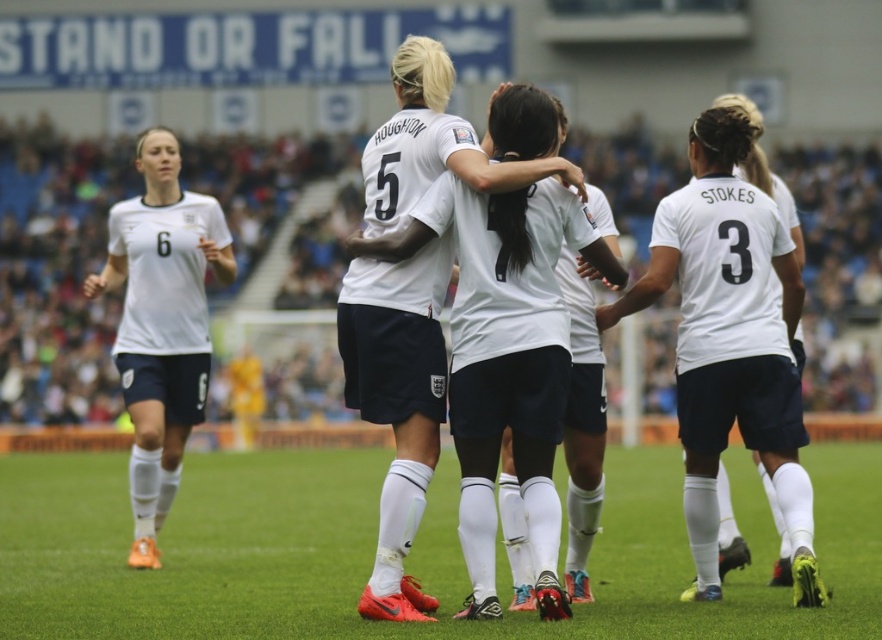
Question: Observing the image, what is the correct spatial positioning of white synthetic turf at center in reference to white matte jersey at left?

Choices:
 (A) left
 (B) right

Answer: (B)

Question: Estimate the real-world distances between objects in this image. Which object is farther from the white synthetic turf at center?

Choices:
 (A) white matte jersey at left
 (B) white matte jersey at center

Answer: (A)

Question: Is white synthetic turf at center positioned before white matte jersey at center?

Choices:
 (A) no
 (B) yes

Answer: (B)

Question: Which of the following is the closest to the observer?

Choices:
 (A) white synthetic turf at center
 (B) white matte jersey at center

Answer: (A)

Question: Which object is positioned farthest from the white matte jersey at center?

Choices:
 (A) white synthetic turf at center
 (B) white matte jersey at left

Answer: (B)

Question: Can you confirm if white matte jersey at center is bigger than white matte jersey at left?

Choices:
 (A) no
 (B) yes

Answer: (A)